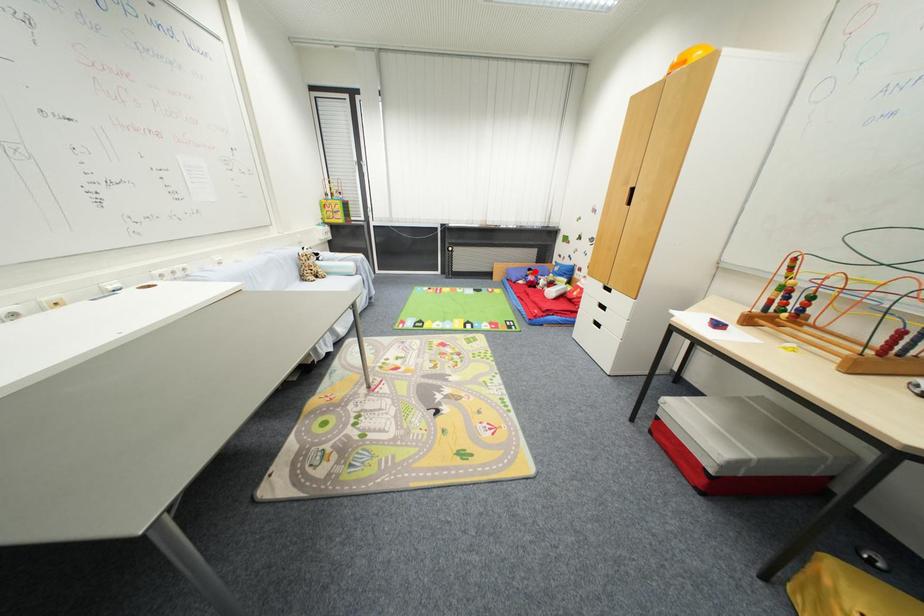
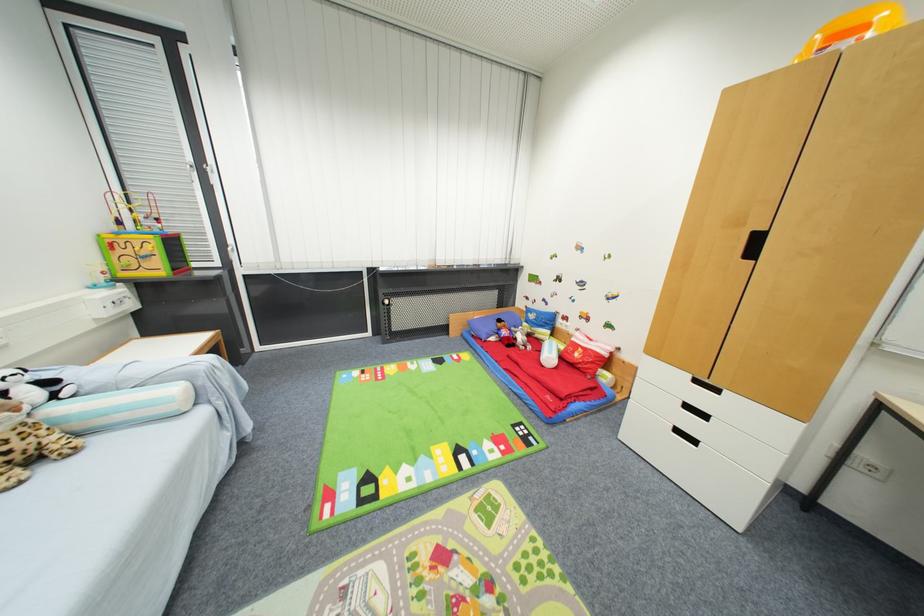
Question: A red point is marked in image1. In image2, is the corresponding 3D point closer to the camera or farther? Reply with the corresponding letter.

Choices:
 (A) The corresponding 3D point is closer.
 (B) The corresponding 3D point is farther.

Answer: (B)